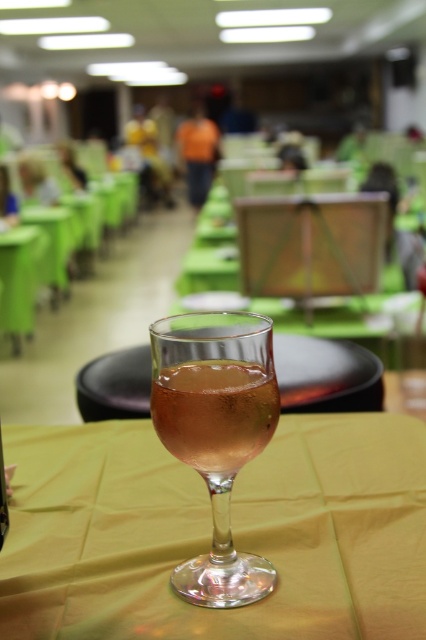
Question: In this image, where is translucent glass at center located relative to green fabric table at lower left?

Choices:
 (A) above
 (B) below

Answer: (B)

Question: Is transparent glass at center positioned before translucent glass at center?

Choices:
 (A) yes
 (B) no

Answer: (A)

Question: Which of the following is the farthest from the observer?

Choices:
 (A) (189, 362)
 (B) (54, 307)
 (C) (23, 576)
 (D) (226, 480)

Answer: (B)

Question: Which point appears closest to the camera in this image?

Choices:
 (A) (17, 256)
 (B) (221, 404)
 (C) (293, 515)

Answer: (B)

Question: Does clear glass wine glass at center have a greater width compared to green fabric table at center?

Choices:
 (A) no
 (B) yes

Answer: (A)

Question: Which object appears closest to the camera in this image?

Choices:
 (A) transparent glass at center
 (B) translucent glass at center
 (C) green fabric table at center
 (D) clear glass wine glass at center

Answer: (A)